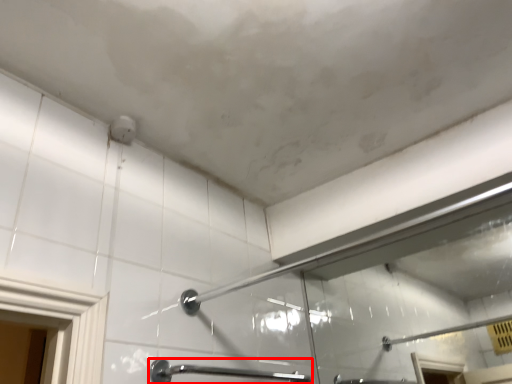
Question: From the image's perspective, what is the correct spatial relationship of door handle (annotated by the red box) in relation to shower?

Choices:
 (A) below
 (B) above

Answer: (A)